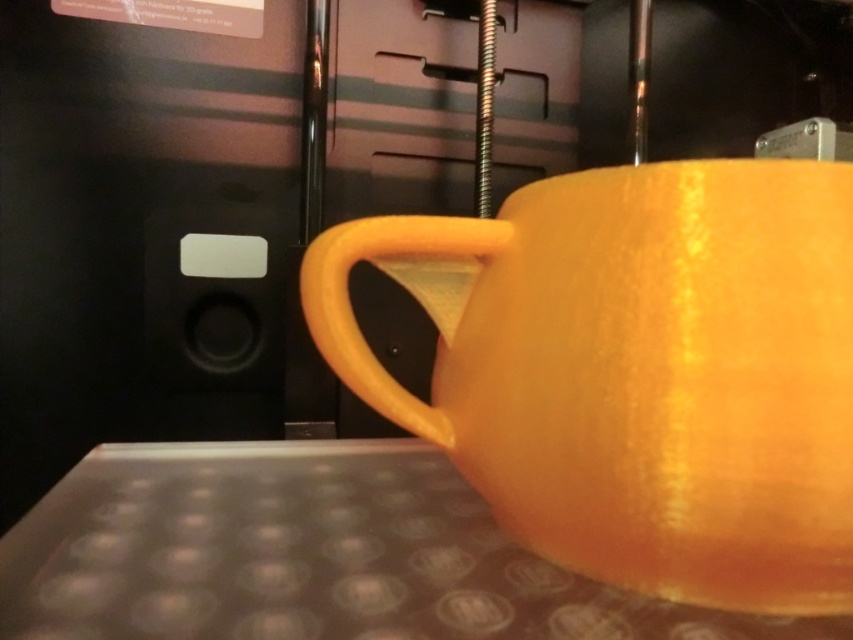
Question: Which object is farther from the camera taking this photo?

Choices:
 (A) glossy ceramic mug at upper center
 (B) translucent plastic table at lower center

Answer: (A)

Question: Does glossy ceramic mug at upper center appear on the left side of translucent plastic table at lower center?

Choices:
 (A) no
 (B) yes

Answer: (A)

Question: Can you confirm if glossy ceramic mug at upper center is positioned to the right of translucent plastic table at lower center?

Choices:
 (A) no
 (B) yes

Answer: (B)

Question: Among these points, which one is nearest to the camera?

Choices:
 (A) (329, 240)
 (B) (91, 563)

Answer: (B)

Question: Can you confirm if glossy ceramic mug at upper center is bigger than translucent plastic table at lower center?

Choices:
 (A) yes
 (B) no

Answer: (A)